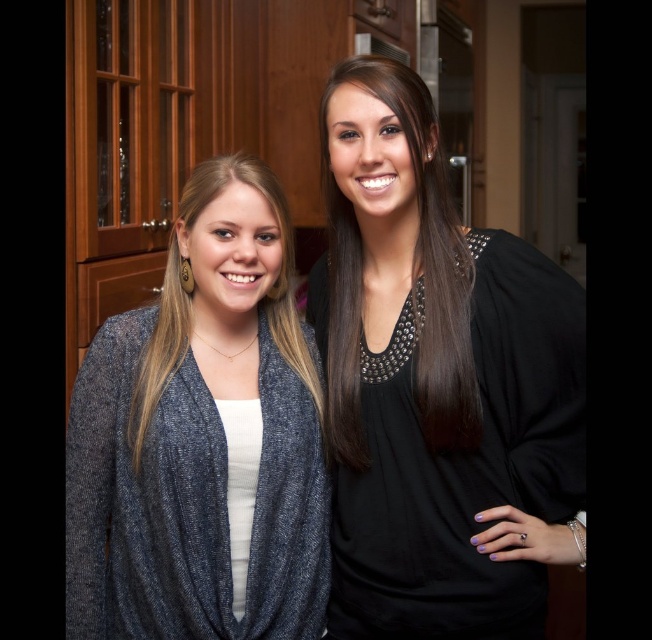
Question: Is knit cardigan at left closer to camera compared to black studded top at center?

Choices:
 (A) no
 (B) yes

Answer: (B)

Question: Which of the following is the farthest from the observer?

Choices:
 (A) (233, 484)
 (B) (338, 76)

Answer: (B)

Question: Among these points, which one is farthest from the camera?

Choices:
 (A) (209, 468)
 (B) (434, 342)
 (C) (331, 214)

Answer: (C)

Question: Does knit cardigan at left have a greater width compared to black studded top at center?

Choices:
 (A) no
 (B) yes

Answer: (B)

Question: Which object is positioned closest to the black studded top at center?

Choices:
 (A) black matte blouse at center
 (B) knit cardigan at left

Answer: (A)

Question: Is black matte blouse at center thinner than knit cardigan at left?

Choices:
 (A) no
 (B) yes

Answer: (A)